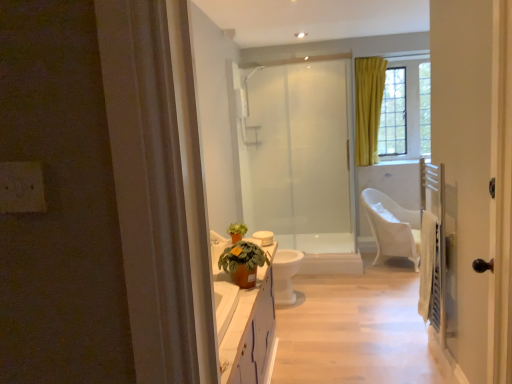
Question: From a real-world perspective, does white plastic chair at right sit lower than terracotta clay pot at center?

Choices:
 (A) yes
 (B) no

Answer: (A)

Question: From the image's perspective, would you say white plastic chair at right is positioned over terracotta clay pot at center?

Choices:
 (A) yes
 (B) no

Answer: (B)

Question: Considering the relative sizes of white plastic chair at right and terracotta clay pot at center in the image provided, is white plastic chair at right smaller than terracotta clay pot at center?

Choices:
 (A) no
 (B) yes

Answer: (A)

Question: Can you confirm if white plastic chair at right is shorter than terracotta clay pot at center?

Choices:
 (A) yes
 (B) no

Answer: (B)

Question: From the image's perspective, is white plastic chair at right under terracotta clay pot at center?

Choices:
 (A) no
 (B) yes

Answer: (B)

Question: From the image's perspective, is white plastic chair at right located above or below yellow fabric curtain at upper right?

Choices:
 (A) above
 (B) below

Answer: (B)

Question: Does point (396, 236) appear closer or farther from the camera than point (404, 104)?

Choices:
 (A) closer
 (B) farther

Answer: (A)

Question: In terms of width, does white plastic chair at right look wider or thinner when compared to yellow fabric curtain at upper right?

Choices:
 (A) wide
 (B) thin

Answer: (A)

Question: Based on their sizes in the image, would you say white plastic chair at right is bigger or smaller than yellow fabric curtain at upper right?

Choices:
 (A) small
 (B) big

Answer: (B)

Question: Does point (274, 299) appear closer or farther from the camera than point (400, 226)?

Choices:
 (A) closer
 (B) farther

Answer: (A)

Question: From a real-world perspective, is white glossy toilet bowl at center above or below white plastic chair at right?

Choices:
 (A) below
 (B) above

Answer: (A)

Question: Would you say white glossy toilet bowl at center is to the left or to the right of white plastic chair at right in the picture?

Choices:
 (A) left
 (B) right

Answer: (A)

Question: Considering the positions of white glossy toilet bowl at center and white plastic chair at right in the image, is white glossy toilet bowl at center bigger or smaller than white plastic chair at right?

Choices:
 (A) big
 (B) small

Answer: (B)

Question: Is frosted glass shower door at center spatially inside yellow fabric curtain at upper right, or outside of it?

Choices:
 (A) inside
 (B) outside

Answer: (B)

Question: Based on their sizes in the image, would you say frosted glass shower door at center is bigger or smaller than yellow fabric curtain at upper right?

Choices:
 (A) big
 (B) small

Answer: (B)